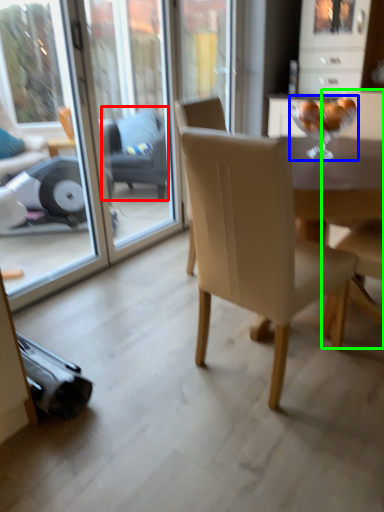
Question: Which is nearer to the swivel chair (highlighted by a red box)? wine glass (highlighted by a blue box) or armchair (highlighted by a green box).

Choices:
 (A) wine glass
 (B) armchair

Answer: (A)